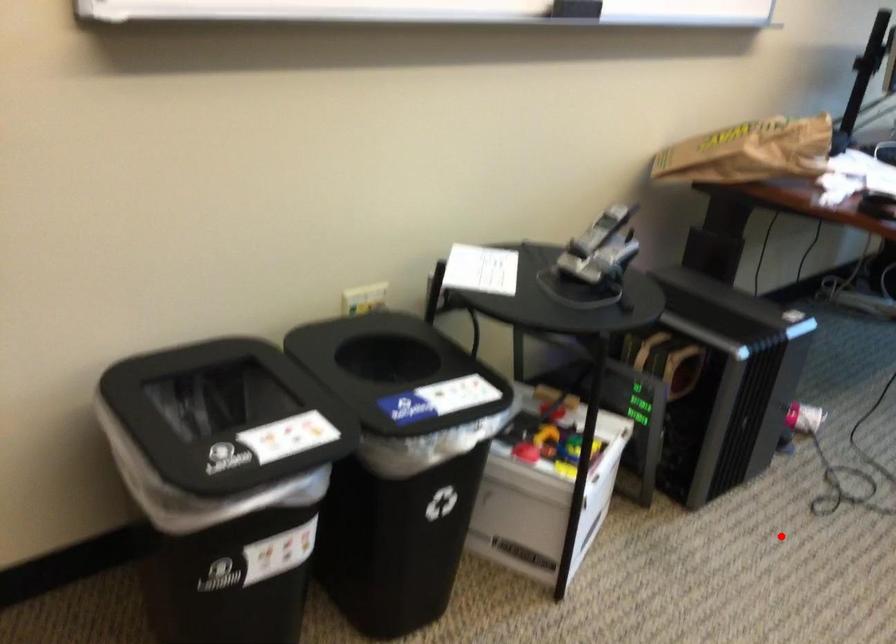
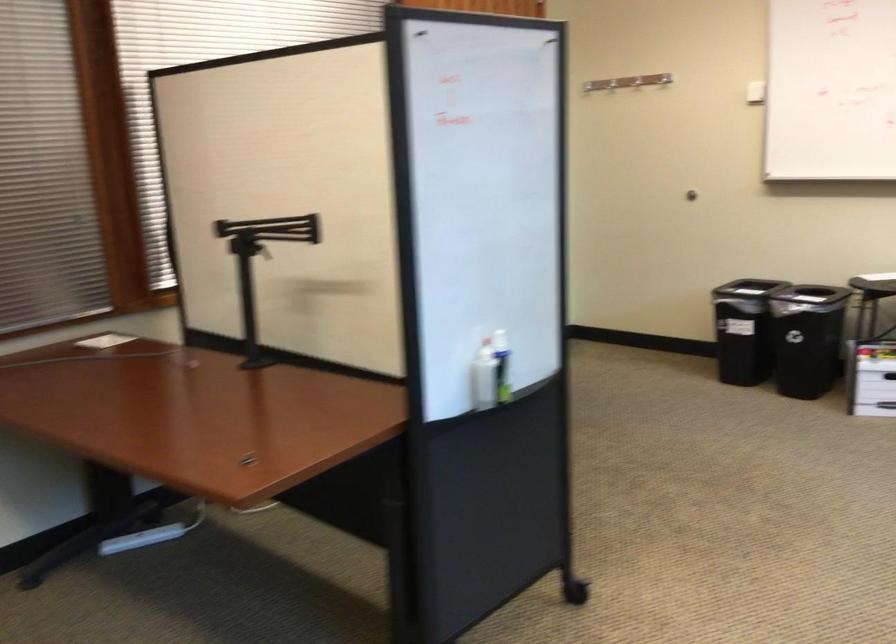
In the second image, find the point that corresponds to the highlighted location in the first image.

(871, 379)